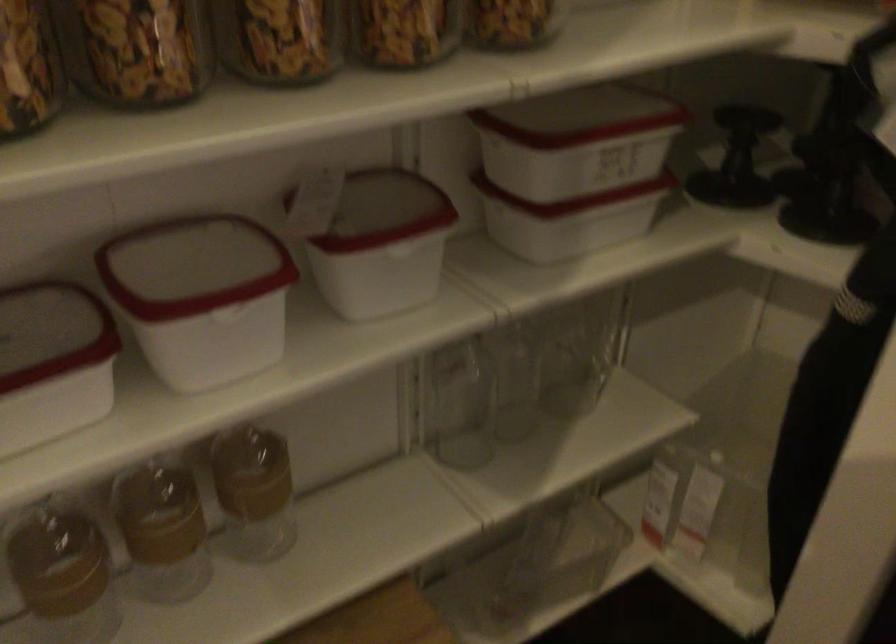
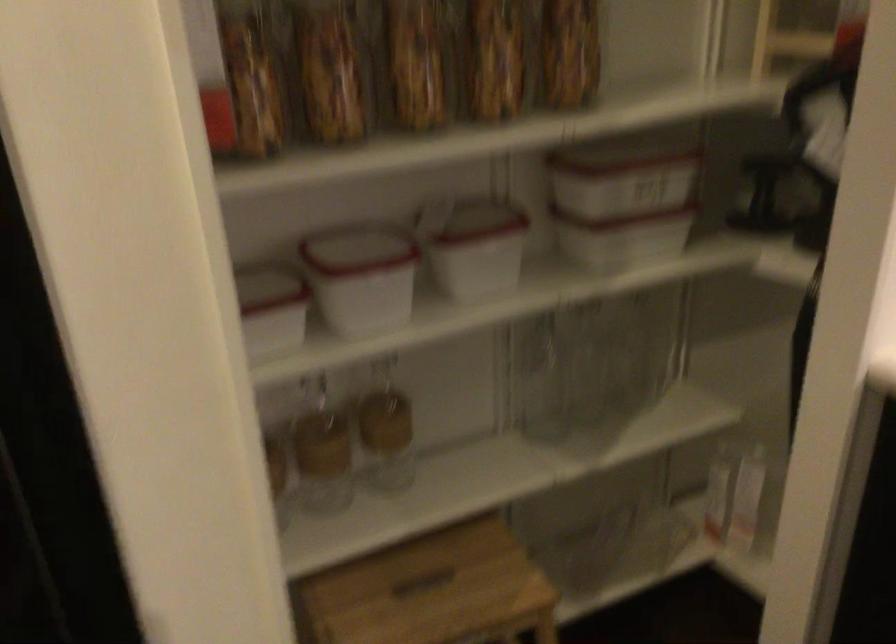
Where in the second image is the point corresponding to (527,366) from the first image?

(599, 371)